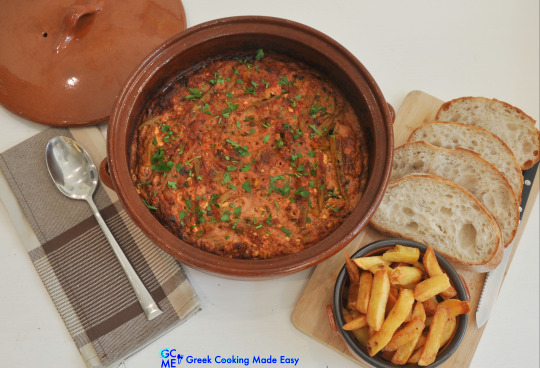
Locate an element on the screen. Image resolution: width=540 pixels, height=368 pixels. crockpot rimcrock pot lid is located at coordinates (315, 258), (107, 47).